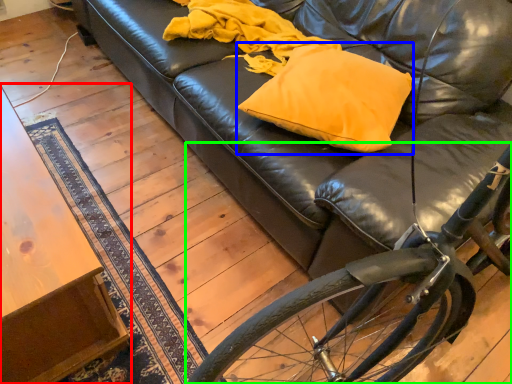
Question: Estimate the real-world distances between objects in this image. Which object is closer to table (highlighted by a red box), throw pillow (highlighted by a blue box) or bicycle (highlighted by a green box)?

Choices:
 (A) throw pillow
 (B) bicycle

Answer: (B)